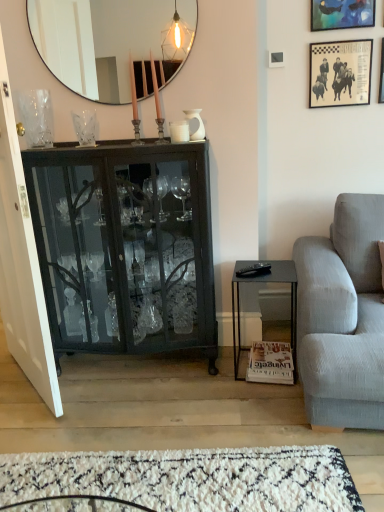
Find the location of a particular element. free space between black metal side table at lower right and white shag rug at lower center is located at coordinates (193, 409).